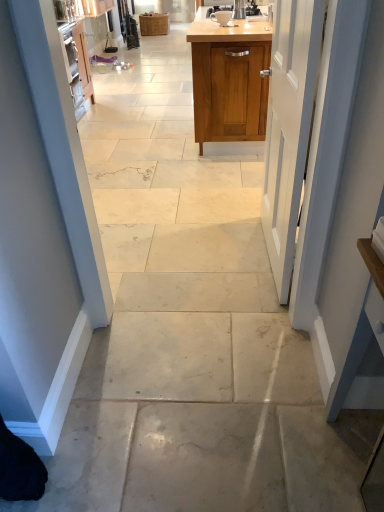
Identify the location of vacant space situated on the left part of white painted wood door at center. The width and height of the screenshot is (384, 512). (195, 253).